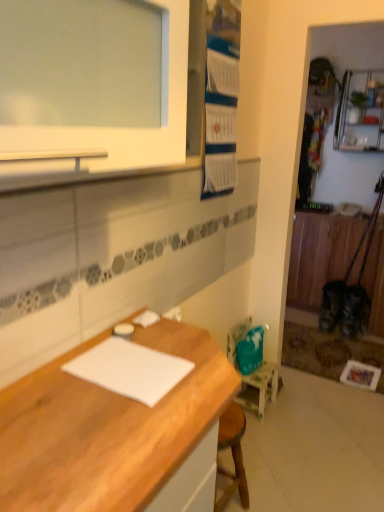
Image resolution: width=384 pixels, height=512 pixels. I want to click on vacant area located to the right-hand side of teal fabric chair at lower right, so click(293, 410).